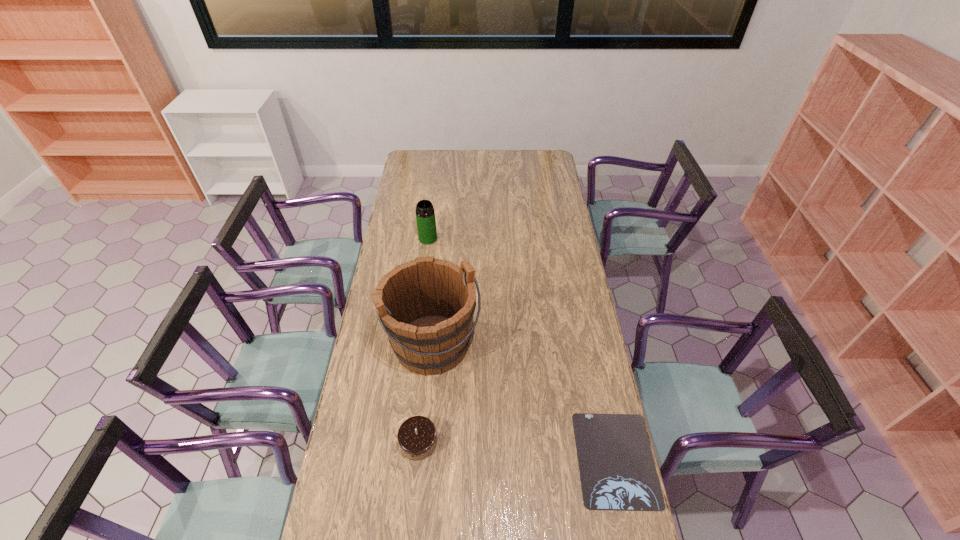
Find the location of a particular element. The image size is (960, 540). free spot between the wine bucket and the chocolate cake is located at coordinates (426, 393).

Locate an element on the screen. vacant region between the second shortest object and the shortest object is located at coordinates (517, 450).

Locate an element on the screen. Image resolution: width=960 pixels, height=540 pixels. empty location between the tallest object and the second shortest object is located at coordinates (426, 393).

Locate an element on the screen. Image resolution: width=960 pixels, height=540 pixels. free point between the rightmost object and the wine bucket is located at coordinates (524, 401).

Where is `the second closest object to the second shortest object`? The width and height of the screenshot is (960, 540). the second closest object to the second shortest object is located at coordinates (617, 471).

This screenshot has width=960, height=540. In order to click on the closest object to the rightmost object in this screenshot , I will do [x=426, y=306].

The image size is (960, 540). I want to click on vacant space that satisfies the following two spatial constraints: 1. on the front side of the tallest object; 2. on the left side of the shortest object, so 423,459.

At what (x,y) coordinates should I click in order to perform the action: click on vacant area that satisfies the following two spatial constraints: 1. on the front side of the third shortest object; 2. on the left side of the chocolate cake. Please return your answer as a coordinate pair (x, y). This screenshot has height=540, width=960. Looking at the image, I should click on (403, 442).

Identify the location of vacant space that satisfies the following two spatial constraints: 1. on the front side of the second shortest object; 2. on the right side of the thermos bottle. (403, 442).